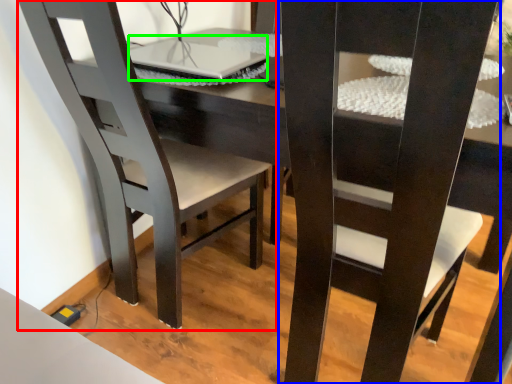
Question: Estimate the real-world distances between objects in this image. Which object is closer to chair (highlighted by a red box), chair (highlighted by a blue box) or laptop (highlighted by a green box)?

Choices:
 (A) chair
 (B) laptop

Answer: (B)